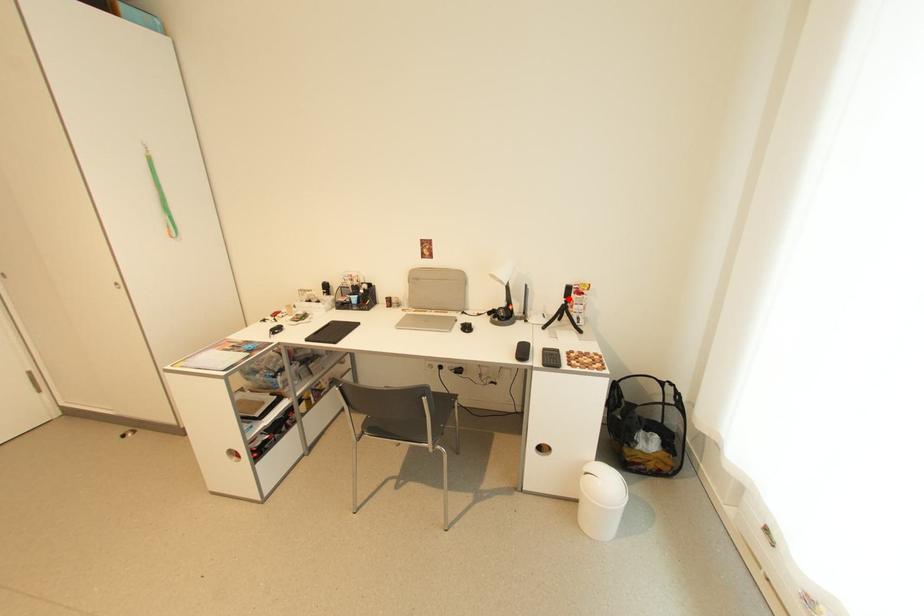
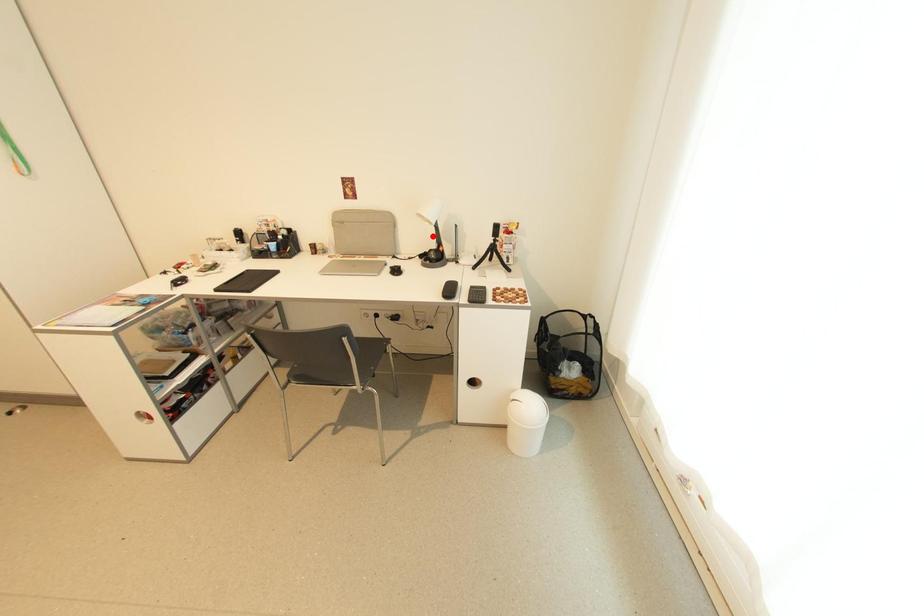
I am providing you with two images of the same scene from different viewpoints. A red point is marked on the first image and another point is marked on the second image. Are the points marked in image1 and image2 representing the same 3D position?

No